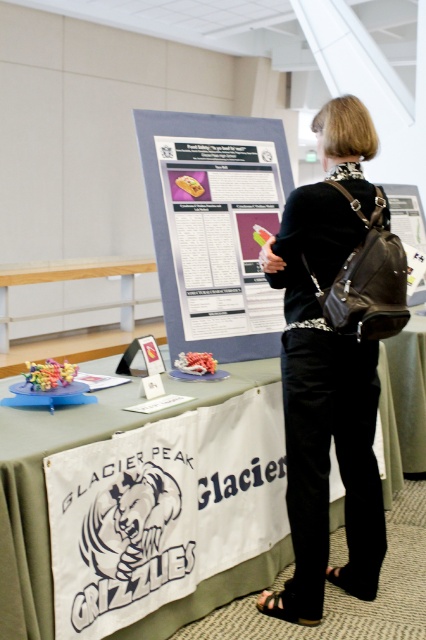
From the picture: Does matte gray poster at center appear on the left side of white fabric banner at lower center?

No, matte gray poster at center is not to the left of white fabric banner at lower center.

Describe the element at coordinates (215, 227) in the screenshot. I see `matte gray poster at center` at that location.

Locate an element on the screen. This screenshot has width=426, height=640. matte gray poster at center is located at coordinates (215, 227).

Does black leather backpack at center appear on the right side of white fabric banner at lower center?

Correct, you'll find black leather backpack at center to the right of white fabric banner at lower center.

The height and width of the screenshot is (640, 426). Find the location of `black leather backpack at center`. black leather backpack at center is located at coordinates (327, 372).

Is point (379, 525) in front of point (2, 534)?

No, (379, 525) is further to viewer.

In order to click on black leather backpack at center in this screenshot , I will do `click(327, 372)`.

Is point (356, 358) closer to viewer compared to point (244, 198)?

That is True.

Who is more distant from viewer, [305,592] or [184,225]?

The point [184,225] is more distant.

Locate an element on the screen. This screenshot has width=426, height=640. black leather backpack at center is located at coordinates (327, 372).